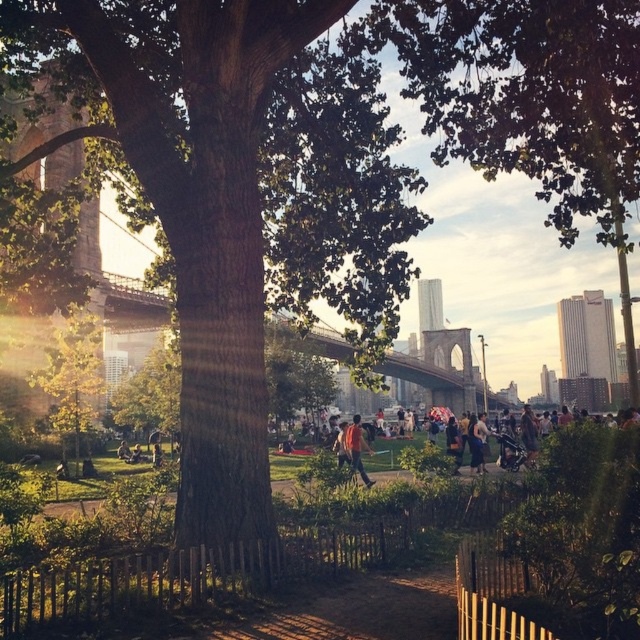
You are a photographer standing in the park and want to take a photo that includes both the green leafy tree at center and the denim shorts at center. However, you want the denim shorts to be clearly visible in the photo. Based on the scene description, is there any issue with capturing both subjects clearly in the same frame?

The green leafy tree at center is in front of the denim shorts at center, so the tree may block or obscure the view of the denim shorts, making it difficult to capture both clearly in the same frame.

In the scene shown: You are standing in the park and see both the green leafy tree at center and the orange fabric jacket at center. Which object is positioned to the left from your perspective?

The green leafy tree at center is to the left of the orange fabric jacket at center.